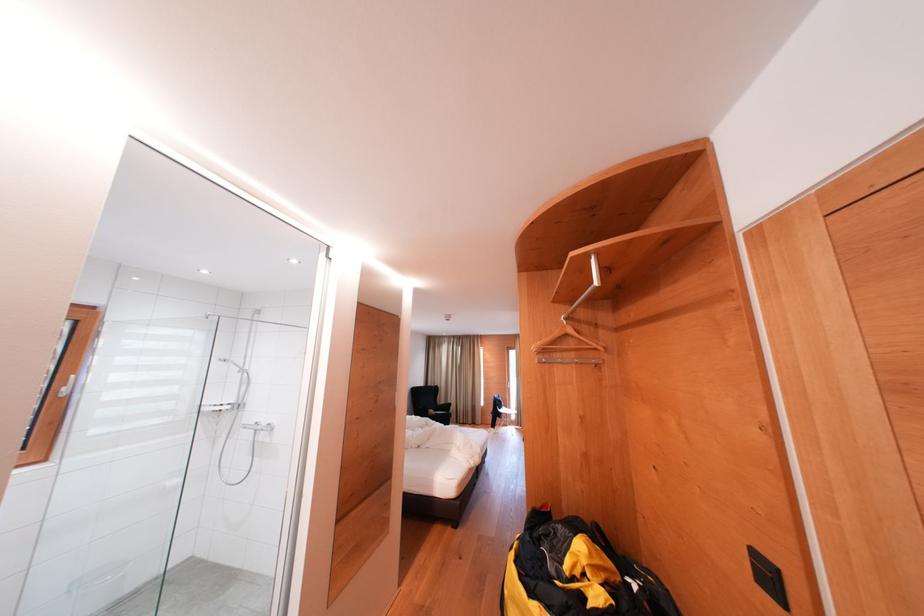
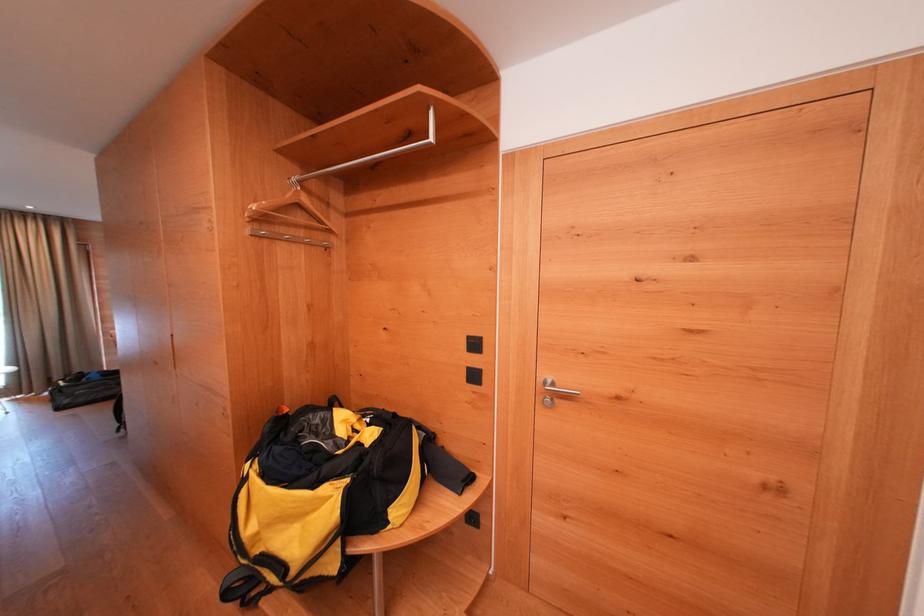
The point at [601,286] is marked in the first image. Where is the corresponding point in the second image?

(434, 142)